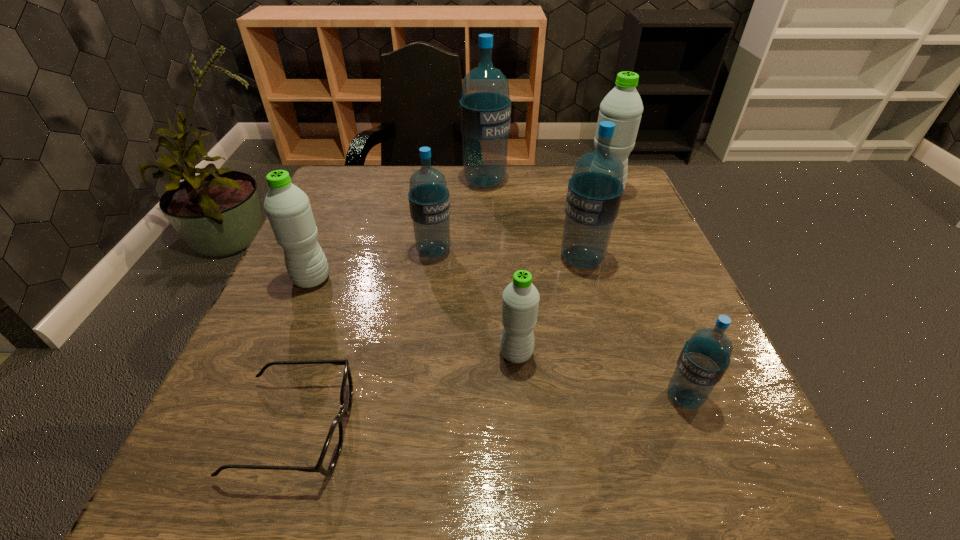
Image resolution: width=960 pixels, height=540 pixels. Identify the location of green water bottle that stands as the second closest to the third object from left to right. (520, 300).

I want to click on green water bottle that is the third closest to the second smallest blue water bottle, so click(623, 106).

Identify the location of free location that satisfies the following two spatial constraints: 1. on the front side of the nearest green water bottle; 2. on the right side of the leftmost blue water bottle. The height and width of the screenshot is (540, 960). (420, 353).

At what (x,y) coordinates should I click in order to perform the action: click on vacant space that satisfies the following two spatial constraints: 1. on the front side of the biggest green water bottle; 2. on the front-facing side of the spectacles. Please return your answer as a coordinate pair (x, y). Looking at the image, I should click on (695, 429).